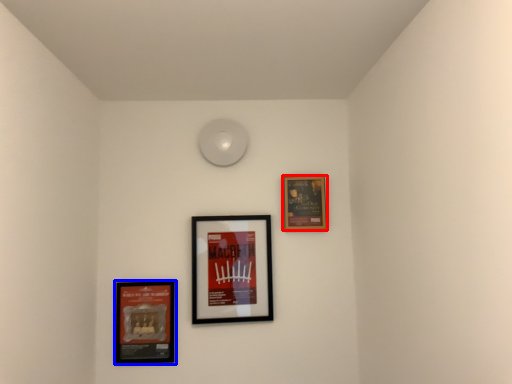
Question: Which object appears closest to the camera in this image, picture frame (highlighted by a red box) or picture frame (highlighted by a blue box)?

Choices:
 (A) picture frame
 (B) picture frame

Answer: (B)